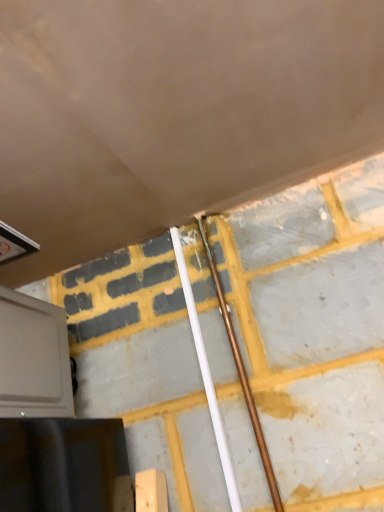
The height and width of the screenshot is (512, 384). I want to click on white plastic pipe at center, the 1th beam from the left, so click(206, 375).

In order to face white plastic pipe at center, the second beam when ordered from right to left, should I rotate leftwards or rightwards?

Turn right approximately 1.159 degrees to face it.

Find the location of a particular element. The image size is (384, 512). copper metallic pipe at center, arranged as the second beam when viewed from the left is located at coordinates (241, 372).

Is white plastic pipe at center, the second beam when ordered from right to left, at the back of gray matte oven at lower left?

No, gray matte oven at lower left is not facing away from white plastic pipe at center, the second beam when ordered from right to left.

From the image's perspective, which one is positioned higher, gray matte oven at lower left or white plastic pipe at center, the 1th beam from the left?

white plastic pipe at center, the 1th beam from the left, from the image's perspective.

From a real-world perspective, between gray matte oven at lower left and white plastic pipe at center, the 1th beam from the left, who is vertically lower?

In real-world perspective, white plastic pipe at center, the 1th beam from the left, is lower.

Are gray matte oven at lower left and white plastic pipe at center, the second beam when ordered from right to left, far apart?

No.

Between gray matte oven at lower left and copper metallic pipe at center, placed as the 1th beam when sorted from right to left, which one appears on the left side from the viewer's perspective?

From the viewer's perspective, gray matte oven at lower left appears more on the left side.

From the image's perspective, who appears lower, gray matte oven at lower left or copper metallic pipe at center, placed as the 1th beam when sorted from right to left?

gray matte oven at lower left is shown below in the image.

Between gray matte oven at lower left and copper metallic pipe at center, placed as the 1th beam when sorted from right to left, which one has smaller width?

copper metallic pipe at center, placed as the 1th beam when sorted from right to left, is thinner.

Could you measure the distance between gray matte oven at lower left and copper metallic pipe at center, placed as the 1th beam when sorted from right to left?

A distance of 15.25 inches exists between gray matte oven at lower left and copper metallic pipe at center, placed as the 1th beam when sorted from right to left.

How much distance is there between white plastic pipe at center, the second beam when ordered from right to left, and gray matte oven at lower left?

A distance of 12.91 inches exists between white plastic pipe at center, the second beam when ordered from right to left, and gray matte oven at lower left.

Find the location of a particular element. This screenshot has width=384, height=512. the 1st beam directly beneath the gray matte oven at lower left (from a real-world perspective) is located at coordinates (206, 375).

Is the surface of white plastic pipe at center, the second beam when ordered from right to left, in direct contact with gray matte oven at lower left?

No, white plastic pipe at center, the second beam when ordered from right to left, is not with gray matte oven at lower left.

Could you tell me if white plastic pipe at center, the 1th beam from the left, is facing gray matte oven at lower left?

No, white plastic pipe at center, the 1th beam from the left, does not turn towards gray matte oven at lower left.

Can you confirm if copper metallic pipe at center, placed as the 1th beam when sorted from right to left, is bigger than gray matte oven at lower left?

Actually, copper metallic pipe at center, placed as the 1th beam when sorted from right to left, might be smaller than gray matte oven at lower left.

Could you tell me if copper metallic pipe at center, arranged as the second beam when viewed from the left, is facing gray matte oven at lower left?

No, copper metallic pipe at center, arranged as the second beam when viewed from the left, is not oriented towards gray matte oven at lower left.

Is copper metallic pipe at center, arranged as the second beam when viewed from the left, placed right next to gray matte oven at lower left?

They are not placed beside each other.

In the image, is copper metallic pipe at center, placed as the 1th beam when sorted from right to left, on the left side or the right side of gray matte oven at lower left?

Clearly, copper metallic pipe at center, placed as the 1th beam when sorted from right to left, is on the right of gray matte oven at lower left in the image.

From the image's perspective, is white plastic pipe at center, the second beam when ordered from right to left, above or below copper metallic pipe at center, arranged as the second beam when viewed from the left?

Clearly, from the image's perspective, white plastic pipe at center, the second beam when ordered from right to left, is below copper metallic pipe at center, arranged as the second beam when viewed from the left.

Which is in front, point (182, 260) or point (258, 426)?

Point (258, 426)

Choose the correct answer: Is white plastic pipe at center, the 1th beam from the left, inside copper metallic pipe at center, placed as the 1th beam when sorted from right to left, or outside it?

white plastic pipe at center, the 1th beam from the left, cannot be found inside copper metallic pipe at center, placed as the 1th beam when sorted from right to left.

In the scene shown: Can you tell me how much white plastic pipe at center, the 1th beam from the left, and copper metallic pipe at center, placed as the 1th beam when sorted from right to left, differ in facing direction?

There is a 0.000304-degree angle between the facing directions of white plastic pipe at center, the 1th beam from the left, and copper metallic pipe at center, placed as the 1th beam when sorted from right to left.

From a real-world perspective, is copper metallic pipe at center, placed as the 1th beam when sorted from right to left, physically above white plastic pipe at center, the second beam when ordered from right to left?

No.

Measure the distance between copper metallic pipe at center, placed as the 1th beam when sorted from right to left, and white plastic pipe at center, the second beam when ordered from right to left.

The distance of copper metallic pipe at center, placed as the 1th beam when sorted from right to left, from white plastic pipe at center, the second beam when ordered from right to left, is 2.73 inches.

Considering the sizes of objects copper metallic pipe at center, placed as the 1th beam when sorted from right to left, and white plastic pipe at center, the second beam when ordered from right to left, in the image provided, who is smaller, copper metallic pipe at center, placed as the 1th beam when sorted from right to left, or white plastic pipe at center, the second beam when ordered from right to left,?

Smaller between the two is white plastic pipe at center, the second beam when ordered from right to left.

Is copper metallic pipe at center, placed as the 1th beam when sorted from right to left, facing towards white plastic pipe at center, the 1th beam from the left?

No, copper metallic pipe at center, placed as the 1th beam when sorted from right to left, is not turned towards white plastic pipe at center, the 1th beam from the left.

The height and width of the screenshot is (512, 384). Find the location of `oven located below the white plastic pipe at center, the 1th beam from the left (from the image's perspective)`. oven located below the white plastic pipe at center, the 1th beam from the left (from the image's perspective) is located at coordinates coord(33,358).

In order to click on oven that appears in front of the copper metallic pipe at center, arranged as the second beam when viewed from the left in this screenshot , I will do `click(33, 358)`.

From the image, which object appears to be farther from white plastic pipe at center, the second beam when ordered from right to left, copper metallic pipe at center, arranged as the second beam when viewed from the left, or gray matte oven at lower left?

Among the two, gray matte oven at lower left is located further to white plastic pipe at center, the second beam when ordered from right to left.

When comparing their distances from gray matte oven at lower left, does copper metallic pipe at center, arranged as the second beam when viewed from the left, or white plastic pipe at center, the second beam when ordered from right to left, seem closer?

white plastic pipe at center, the second beam when ordered from right to left, lies closer to gray matte oven at lower left than the other object.

Looking at the image, which one is located closer to copper metallic pipe at center, arranged as the second beam when viewed from the left, white plastic pipe at center, the 1th beam from the left, or gray matte oven at lower left?

white plastic pipe at center, the 1th beam from the left, is positioned closer to the anchor copper metallic pipe at center, arranged as the second beam when viewed from the left.

Based on their spatial positions, is gray matte oven at lower left or white plastic pipe at center, the second beam when ordered from right to left, closer to copper metallic pipe at center, placed as the 1th beam when sorted from right to left?

Among the two, white plastic pipe at center, the second beam when ordered from right to left, is located nearer to copper metallic pipe at center, placed as the 1th beam when sorted from right to left.

Estimate the real-world distances between objects in this image. Which object is further from white plastic pipe at center, the 1th beam from the left, gray matte oven at lower left or copper metallic pipe at center, arranged as the second beam when viewed from the left?

The object further to white plastic pipe at center, the 1th beam from the left, is gray matte oven at lower left.

From the image, which object appears to be nearer to gray matte oven at lower left, white plastic pipe at center, the 1th beam from the left, or copper metallic pipe at center, placed as the 1th beam when sorted from right to left?

The object closer to gray matte oven at lower left is white plastic pipe at center, the 1th beam from the left.

Find the location of a particular element. The image size is (384, 512). beam between gray matte oven at lower left and copper metallic pipe at center, placed as the 1th beam when sorted from right to left is located at coordinates (206, 375).